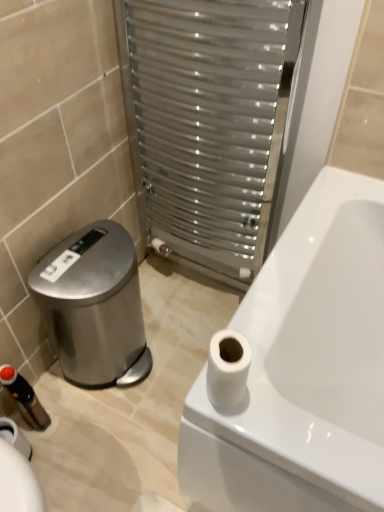
Question: Can you confirm if polished stainless steel water cooler at lower left is positioned to the right of black plastic toiletry at lower left?

Choices:
 (A) no
 (B) yes

Answer: (B)

Question: Are polished stainless steel water cooler at lower left and black plastic toiletry at lower left far apart?

Choices:
 (A) no
 (B) yes

Answer: (A)

Question: Can you confirm if polished stainless steel water cooler at lower left is smaller than black plastic toiletry at lower left?

Choices:
 (A) no
 (B) yes

Answer: (A)

Question: Is black plastic toiletry at lower left a part of polished stainless steel water cooler at lower left?

Choices:
 (A) no
 (B) yes

Answer: (A)

Question: Considering the relative positions of polished stainless steel water cooler at lower left and black plastic toiletry at lower left in the image provided, is polished stainless steel water cooler at lower left to the left of black plastic toiletry at lower left from the viewer's perspective?

Choices:
 (A) yes
 (B) no

Answer: (B)

Question: Is polished stainless steel water cooler at lower left facing towards black plastic toiletry at lower left?

Choices:
 (A) no
 (B) yes

Answer: (A)

Question: Does white matte toilet paper at upper right have a greater width compared to polished stainless steel water cooler at lower left?

Choices:
 (A) no
 (B) yes

Answer: (A)

Question: From a real-world perspective, is white matte toilet paper at upper right positioned over polished stainless steel water cooler at lower left based on gravity?

Choices:
 (A) no
 (B) yes

Answer: (B)

Question: Is the position of white matte toilet paper at upper right less distant than that of polished stainless steel water cooler at lower left?

Choices:
 (A) no
 (B) yes

Answer: (B)

Question: Considering the relative sizes of white matte toilet paper at upper right and polished stainless steel water cooler at lower left in the image provided, is white matte toilet paper at upper right smaller than polished stainless steel water cooler at lower left?

Choices:
 (A) no
 (B) yes

Answer: (B)

Question: Is white matte toilet paper at upper right next to polished stainless steel water cooler at lower left?

Choices:
 (A) no
 (B) yes

Answer: (A)

Question: Is white matte toilet paper at upper right taller than polished stainless steel water cooler at lower left?

Choices:
 (A) yes
 (B) no

Answer: (B)

Question: From a real-world perspective, does black plastic toiletry at lower left stand above white matte toilet paper at upper right?

Choices:
 (A) yes
 (B) no

Answer: (B)